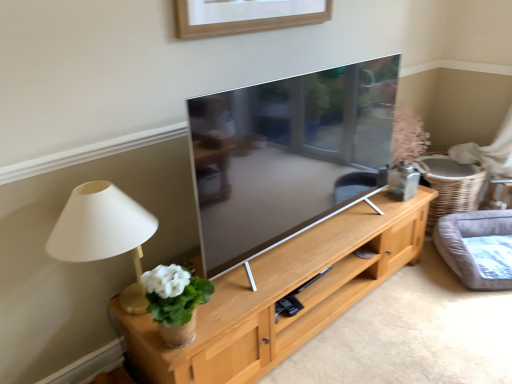
Question: Is the position of gray fabric cat bed at right less distant than that of matte beige lamp at left?

Choices:
 (A) no
 (B) yes

Answer: (A)

Question: From a real-world perspective, is gray fabric cat bed at right on top of matte beige lamp at left?

Choices:
 (A) no
 (B) yes

Answer: (A)

Question: From a real-world perspective, is gray fabric cat bed at right located beneath matte beige lamp at left?

Choices:
 (A) yes
 (B) no

Answer: (A)

Question: Is gray fabric cat bed at right completely or partially outside of matte beige lamp at left?

Choices:
 (A) yes
 (B) no

Answer: (A)

Question: Is gray fabric cat bed at right smaller than matte beige lamp at left?

Choices:
 (A) yes
 (B) no

Answer: (B)

Question: Is matte beige lamp at left wider or thinner than light wood cabinet at center?

Choices:
 (A) wide
 (B) thin

Answer: (B)

Question: From a real-world perspective, relative to light wood cabinet at center, is matte beige lamp at left vertically above or below?

Choices:
 (A) above
 (B) below

Answer: (A)

Question: From their relative heights in the image, would you say matte beige lamp at left is taller or shorter than light wood cabinet at center?

Choices:
 (A) tall
 (B) short

Answer: (A)

Question: Is point (135, 283) positioned closer to the camera than point (335, 253)?

Choices:
 (A) farther
 (B) closer

Answer: (B)

Question: Is white ceramic vase at left taller or shorter than light wood cabinet at center?

Choices:
 (A) short
 (B) tall

Answer: (B)

Question: Would you say white ceramic vase at left is to the left or to the right of light wood cabinet at center in the picture?

Choices:
 (A) left
 (B) right

Answer: (A)

Question: Is point (185, 332) closer or farther from the camera than point (396, 215)?

Choices:
 (A) farther
 (B) closer

Answer: (B)

Question: Relative to light wood cabinet at center, is white ceramic vase at left in front or behind?

Choices:
 (A) front
 (B) behind

Answer: (B)

Question: From their relative heights in the image, would you say light wood cabinet at center is taller or shorter than gray fabric cat bed at right?

Choices:
 (A) short
 (B) tall

Answer: (A)

Question: From a real-world perspective, is light wood cabinet at center positioned above or below gray fabric cat bed at right?

Choices:
 (A) above
 (B) below

Answer: (B)